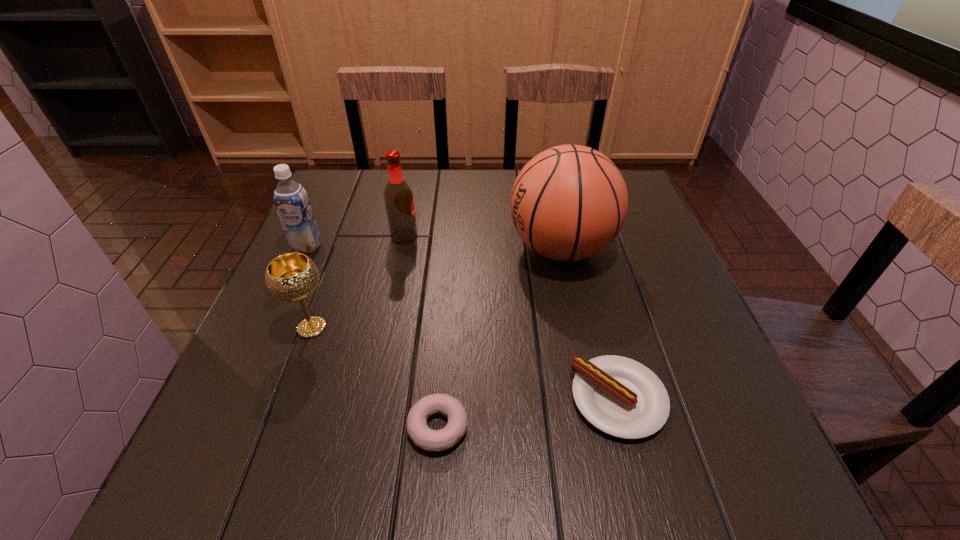
The width and height of the screenshot is (960, 540). Find the location of `vacant region located 0.400m on the surface of the basketball near the brand logo`. vacant region located 0.400m on the surface of the basketball near the brand logo is located at coordinates (343, 248).

Locate an element on the screen. free space located 0.130m on the right of the beer bottle is located at coordinates (469, 237).

You are a GUI agent. You are given a task and a screenshot of the screen. Output one action in this format:
    pyautogui.click(x=<x>, y=<y>)
    Task: Click on the free space located 0.320m on the label of the leftmost object
    This screenshot has width=960, height=540.
    Given the screenshot: What is the action you would take?
    pyautogui.click(x=252, y=366)

You are a GUI agent. You are given a task and a screenshot of the screen. Output one action in this format:
    pyautogui.click(x=<x>, y=<y>)
    Task: Click on the free location located 0.150m on the right of the second object from left to right
    The height and width of the screenshot is (540, 960).
    Given the screenshot: What is the action you would take?
    pyautogui.click(x=409, y=328)

Find the location of `free space located on the left of the second shortest object`. free space located on the left of the second shortest object is located at coordinates (382, 399).

Identify the location of vacant point located on the left of the shortest object. The height and width of the screenshot is (540, 960). (245, 427).

This screenshot has width=960, height=540. In order to click on sausage positioned at the near edge in this screenshot , I will do `click(621, 397)`.

Find the location of `doughnut present at the near edge`. doughnut present at the near edge is located at coordinates (422, 436).

Where is `soya milk at the left edge`? The width and height of the screenshot is (960, 540). soya milk at the left edge is located at coordinates (292, 203).

Where is `chalice positioned at the left edge`? chalice positioned at the left edge is located at coordinates (293, 276).